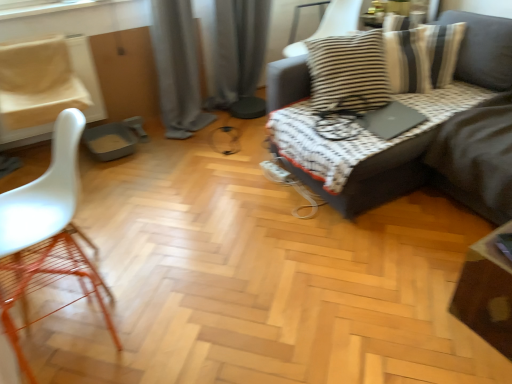
Question: From their relative heights in the image, would you say gray fabric curtain at center, which is the second curtain from right to left, is taller or shorter than white matte chair at left, acting as the first chair starting from the bottom?

Choices:
 (A) short
 (B) tall

Answer: (B)

Question: In the image, is gray fabric curtain at center, which is the second curtain from right to left, positioned in front of or behind white matte chair at left, positioned as the third chair in back-to-front order?

Choices:
 (A) behind
 (B) front

Answer: (A)

Question: Estimate the real-world distances between objects in this image. Which object is closer to the striped fabric cushion at upper right, which is the first chair from right to left?

Choices:
 (A) black matte laptop at upper right
 (B) wooden table at lower right
 (C) gray fabric curtain at center, the 1th curtain positioned from the right
 (D) white plastic chair at left, positioned as the second chair in front-to-back order
 (E) dark gray fabric couch at upper right

Answer: (C)

Question: Which of these objects is positioned farthest from the striped fabric cushion at upper right, placed as the first chair when sorted from back to front?

Choices:
 (A) wooden table at lower right
 (B) black matte laptop at upper right
 (C) white matte chair at left, which is the third chair in top-to-bottom order
 (D) gray fabric curtain at center, which is the second curtain from right to left
 (E) white plastic chair at left, positioned as the 2th chair in back-to-front order

Answer: (C)